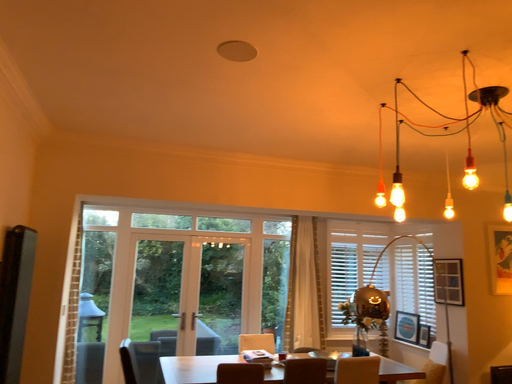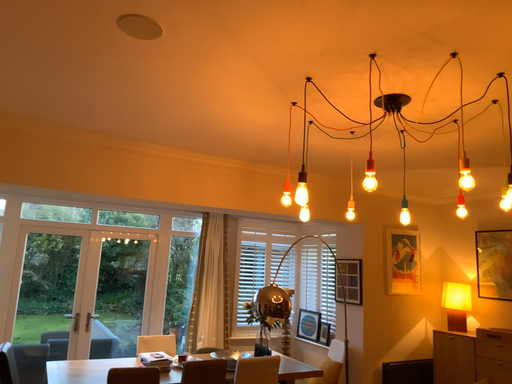
Question: Which way did the camera rotate in the video?

Choices:
 (A) rotated left
 (B) rotated right

Answer: (B)